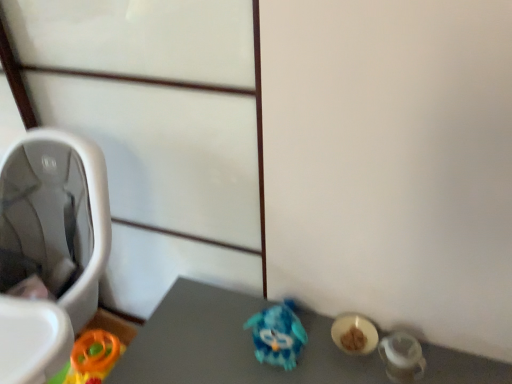
The width and height of the screenshot is (512, 384). What do you see at coordinates (277, 335) in the screenshot?
I see `blue plastic toy at center` at bounding box center [277, 335].

Describe the element at coordinates (229, 345) in the screenshot. Image resolution: width=512 pixels, height=384 pixels. I see `blue shiny toy at center` at that location.

Find the location of `blue plastic toy at center`. blue plastic toy at center is located at coordinates (277, 335).

Is blue shiny toy at center not within blue plastic toy at center?

Yes, blue shiny toy at center is not within blue plastic toy at center.

Is blue shiny toy at center in front of blue plastic toy at center?

Yes, it is in front of blue plastic toy at center.

From a real-world perspective, is blue shiny toy at center below blue plastic toy at center?

Yes, from a real-world perspective, blue shiny toy at center is beneath blue plastic toy at center.

Is blue shiny toy at center not near blue plastic toy at center?

No, blue shiny toy at center is not far from blue plastic toy at center.

Is the position of blue shiny toy at center more distant than that of white plastic baby carriage at left?

Yes, the depth of blue shiny toy at center is greater than that of white plastic baby carriage at left.

Can you confirm if blue shiny toy at center is smaller than white plastic baby carriage at left?

Correct, blue shiny toy at center occupies less space than white plastic baby carriage at left.

Is blue shiny toy at center far from white plastic baby carriage at left?

No.

Can we say white plastic baby carriage at left lies outside blue shiny toy at center?

Yes, white plastic baby carriage at left is not within blue shiny toy at center.

Looking at their sizes, would you say white plastic baby carriage at left is wider or thinner than blue shiny toy at center?

Considering their sizes, white plastic baby carriage at left looks broader than blue shiny toy at center.

Does point (12, 367) lie in front of point (218, 322)?

Yes, it is in front of point (218, 322).

Measure the distance between white plastic baby carriage at left and blue shiny toy at center.

15.70 inches.

Is blue plastic toy at center facing towards white plastic baby carriage at left?

No, blue plastic toy at center is not aimed at white plastic baby carriage at left.

Is blue plastic toy at center far away from white plastic baby carriage at left?

No.

From a real-world perspective, is blue plastic toy at center physically located above or below white plastic baby carriage at left?

Clearly, from a real-world perspective, blue plastic toy at center is above white plastic baby carriage at left.

Does point (282, 334) come in front of point (89, 247)?

Yes, point (282, 334) is closer to viewer.

Considering the relative positions of white plastic baby carriage at left and blue plastic toy at center in the image provided, is white plastic baby carriage at left to the left or to the right of blue plastic toy at center?

In the image, white plastic baby carriage at left appears on the left side of blue plastic toy at center.

Considering the positions of point (37, 231) and point (291, 326), is point (37, 231) closer or farther from the camera than point (291, 326)?

Point (37, 231) appears to be farther away from the viewer than point (291, 326).

Locate an element on the screen. toy on the right side of white plastic baby carriage at left is located at coordinates (277, 335).

Between point (278, 347) and point (318, 324), which one is positioned behind?

The point (318, 324) is farther.

Is blue plastic toy at center to the left of blue shiny toy at center from the viewer's perspective?

Indeed, blue plastic toy at center is positioned on the left side of blue shiny toy at center.

Would you say blue plastic toy at center is a long distance from blue shiny toy at center?

blue plastic toy at center is actually quite close to blue shiny toy at center.

Where is `vanity on the right of the blue plastic toy at center`? The width and height of the screenshot is (512, 384). vanity on the right of the blue plastic toy at center is located at coordinates (229, 345).

You are a GUI agent. You are given a task and a screenshot of the screen. Output one action in this format:
    pyautogui.click(x=<x>, y=<y>)
    Task: Click on the baby carriage that is on the left side of blue shiny toy at center
    This screenshot has height=384, width=512.
    Given the screenshot: What is the action you would take?
    pyautogui.click(x=50, y=248)

Which object lies nearer to the anchor point blue shiny toy at center, white plastic baby carriage at left or blue plastic toy at center?

Based on the image, blue plastic toy at center appears to be nearer to blue shiny toy at center.

Looking at the image, which one is located further to blue shiny toy at center, blue plastic toy at center or white plastic baby carriage at left?

white plastic baby carriage at left.

Which object lies nearer to the anchor point white plastic baby carriage at left, blue shiny toy at center or blue plastic toy at center?

blue shiny toy at center.

Which object lies nearer to the anchor point white plastic baby carriage at left, blue plastic toy at center or blue shiny toy at center?

Among the two, blue shiny toy at center is located nearer to white plastic baby carriage at left.

Estimate the real-world distances between objects in this image. Which object is closer to blue plastic toy at center, white plastic baby carriage at left or blue shiny toy at center?

blue shiny toy at center is closer to blue plastic toy at center.

Which object lies nearer to the anchor point blue plastic toy at center, blue shiny toy at center or white plastic baby carriage at left?

The object closer to blue plastic toy at center is blue shiny toy at center.

Locate an element on the screen. toy between white plastic baby carriage at left and blue shiny toy at center in the horizontal direction is located at coordinates point(277,335).